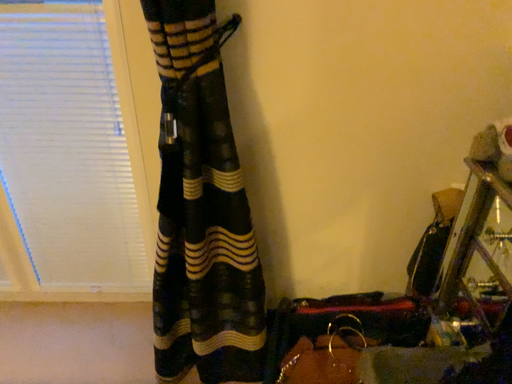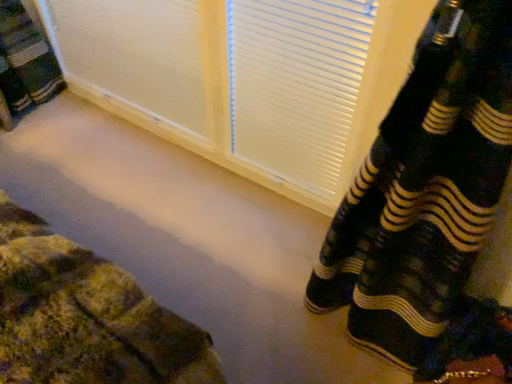
Question: How did the camera likely rotate when shooting the video?

Choices:
 (A) rotated upward
 (B) rotated downward

Answer: (B)